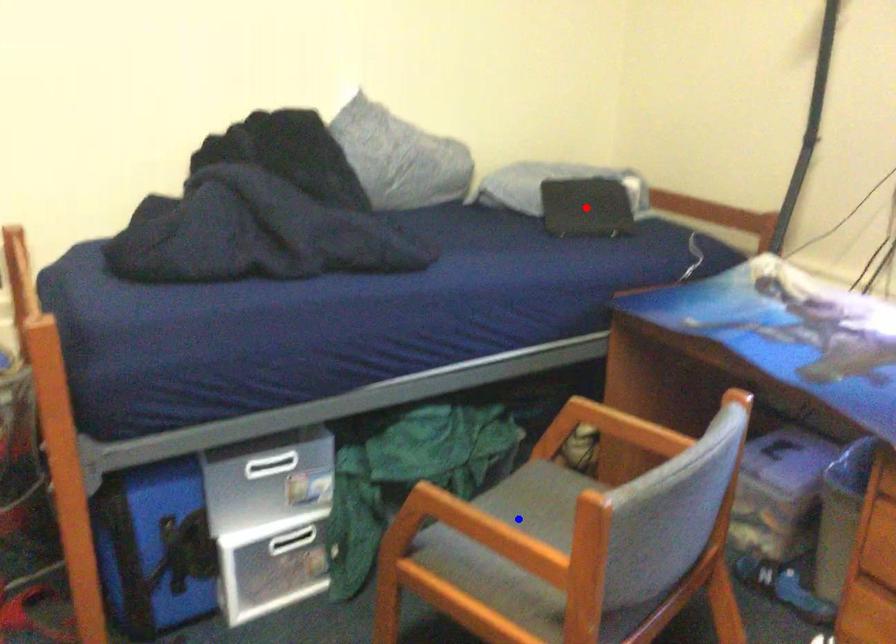
Question: In the image, two points are highlighted. Which point is nearer to the camera? Reply with the corresponding letter.

Choices:
 (A) blue point
 (B) red point

Answer: (A)